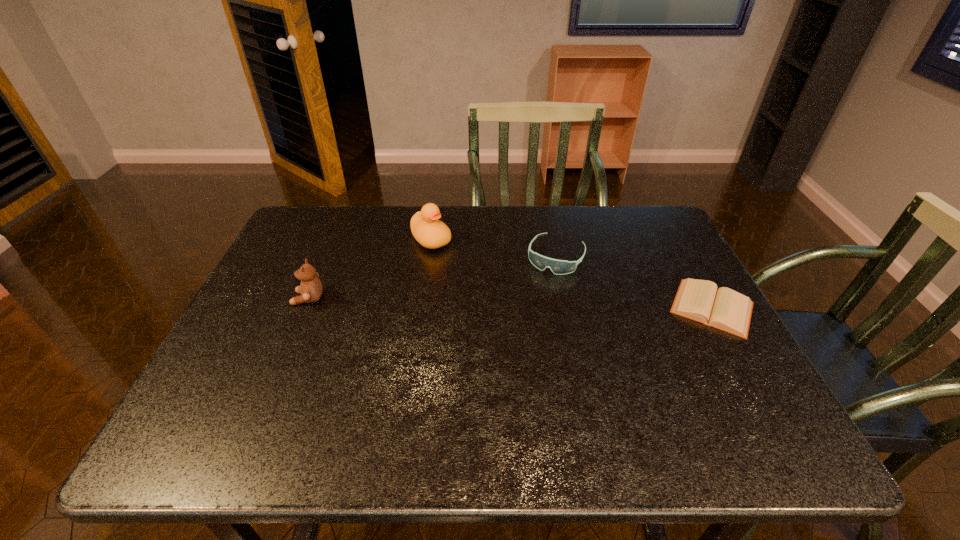
You are a GUI agent. You are given a task and a screenshot of the screen. Output one action in this format:
    pyautogui.click(x=<x>, y=<y>)
    Task: Click on the free space located on the face of the duck
    This screenshot has height=540, width=960.
    Given the screenshot: What is the action you would take?
    pyautogui.click(x=454, y=261)

Find the location of a particular element. This screenshot has width=960, height=540. free region located 0.220m on the face of the duck is located at coordinates (489, 292).

Locate an element on the screen. This screenshot has width=960, height=540. blank area located 0.110m on the face of the duck is located at coordinates (464, 270).

Where is `free location located on the front-facing side of the third tallest object`? free location located on the front-facing side of the third tallest object is located at coordinates [541, 286].

Where is `blank space located 0.290m on the front-facing side of the third tallest object`? blank space located 0.290m on the front-facing side of the third tallest object is located at coordinates (509, 350).

Locate an element on the screen. blank space located 0.230m on the front-facing side of the third tallest object is located at coordinates (517, 332).

This screenshot has height=540, width=960. In order to click on duck present at the far edge in this screenshot , I will do `click(430, 232)`.

Where is `goggles present at the far edge`? Image resolution: width=960 pixels, height=540 pixels. goggles present at the far edge is located at coordinates (559, 267).

This screenshot has height=540, width=960. What are the coordinates of `object present at the left edge` in the screenshot? It's located at tap(311, 288).

At what (x,y) coordinates should I click in order to perform the action: click on object that is at the right edge. Please return your answer as a coordinate pair (x, y). Image resolution: width=960 pixels, height=540 pixels. Looking at the image, I should click on (699, 300).